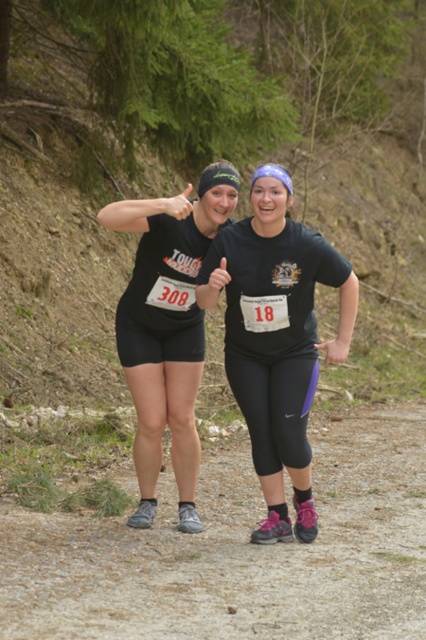
Question: Can you confirm if dirt track at center is positioned to the left of black matte t-shirt at center?

Choices:
 (A) no
 (B) yes

Answer: (A)

Question: From the image, what is the correct spatial relationship of dirt track at center in relation to black matte t-shirt at center?

Choices:
 (A) above
 (B) below

Answer: (B)

Question: Can you confirm if dirt track at center is positioned below black matte t-shirt at center?

Choices:
 (A) no
 (B) yes

Answer: (B)

Question: Which point is farther from the camera taking this photo?

Choices:
 (A) (256, 193)
 (B) (14, 515)

Answer: (B)

Question: Which of the following is the closest to the observer?

Choices:
 (A) (175, 579)
 (B) (147, 205)

Answer: (A)